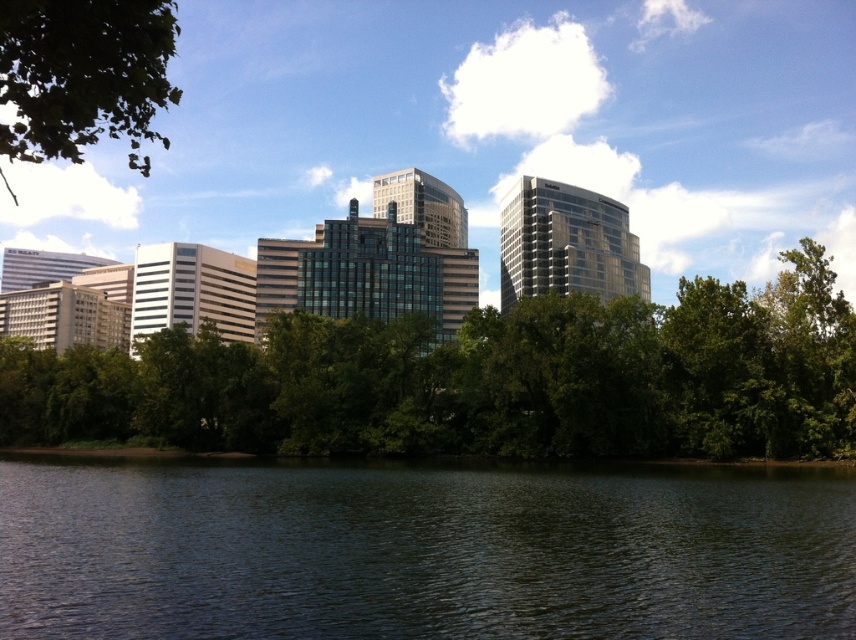
Question: Which point is farther to the camera?

Choices:
 (A) (783, 310)
 (B) (48, 28)

Answer: (A)

Question: Which point is closer to the camera?

Choices:
 (A) dark green water at lower center
 (B) green leafy trees at center

Answer: (A)

Question: Is green leafy trees at center to the right of green leafy tree at upper left from the viewer's perspective?

Choices:
 (A) yes
 (B) no

Answer: (A)

Question: Can you confirm if dark green water at lower center is positioned to the right of green leafy tree at upper left?

Choices:
 (A) yes
 (B) no

Answer: (A)

Question: Can you confirm if dark green water at lower center is positioned to the right of green leafy tree at upper left?

Choices:
 (A) yes
 (B) no

Answer: (A)

Question: Among these points, which one is nearest to the camera?

Choices:
 (A) (510, 468)
 (B) (88, 81)
 (C) (191, 413)

Answer: (B)